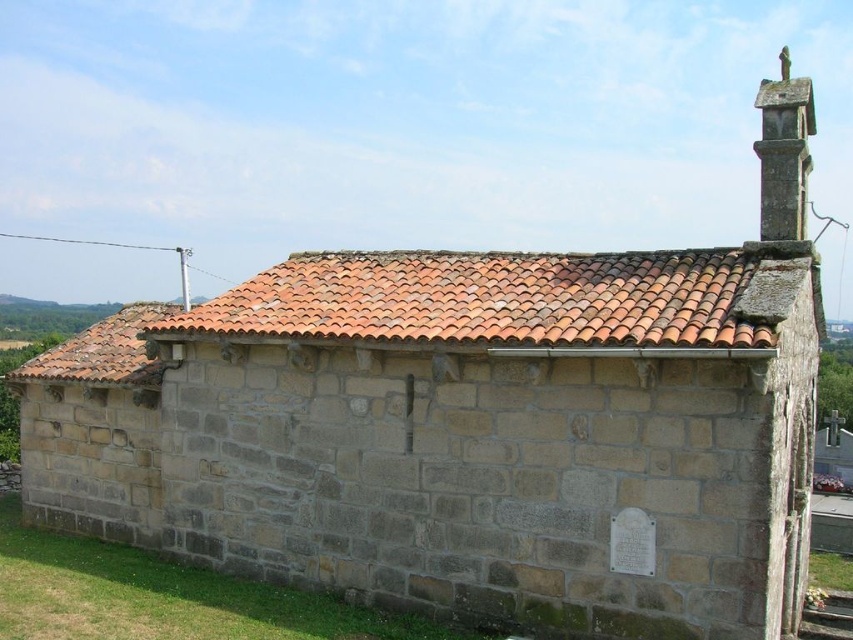
You are a tourist standing in front of the traditional stone building. You notice two features on the roof area. Which one is positioned to the left of the other? The terracotta tiles at upper center and the smooth stone chimney at upper right. Please specify which is to the left.

The terracotta tiles at upper center are positioned to the left of the smooth stone chimney at upper right.

You are standing in front of the traditional stone building and want to place a small statue exactly at point [492,300]. According to the image, where on the building will this point be located?

The point [492,300] is on the terracotta tiles at upper center of the building, so placing the statue there would position it on the roof tiles near the middle top section.

You are an architect assessing the building structure. You notice the terracotta tiles at upper center and the smooth stone chimney at upper right. Which of these two objects has a narrower width?

The terracotta tiles at upper center has a lesser width compared to the smooth stone chimney at upper right, so the terracotta tiles at upper center is narrower in width.